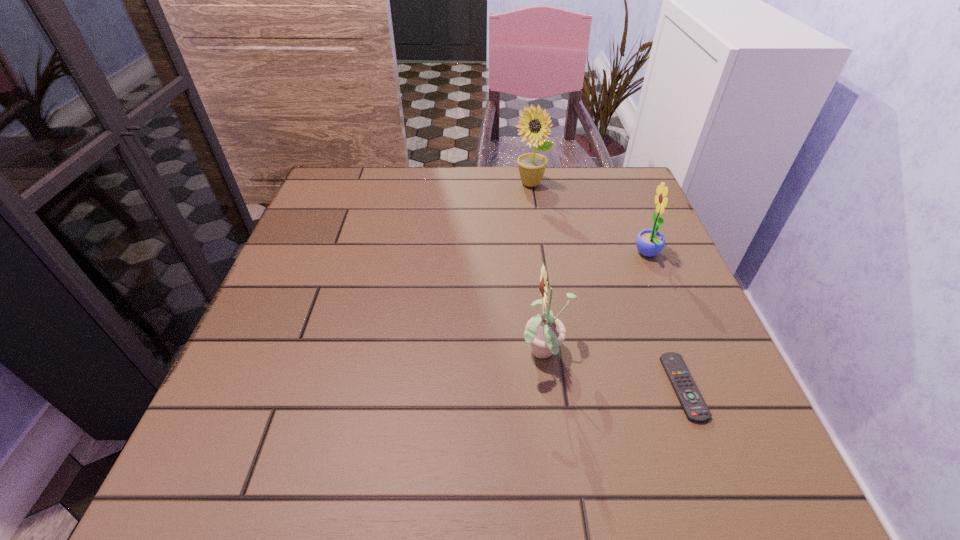
I want to click on vacant space situated on the front-facing side of the rightmost sunflower, so click(553, 254).

Identify the location of free space located 0.320m on the front-facing side of the rightmost sunflower. (490, 254).

Where is `blank space located 0.390m on the left of the shortest object`? This screenshot has width=960, height=540. blank space located 0.390m on the left of the shortest object is located at coordinates pyautogui.click(x=435, y=387).

You are a GUI agent. You are given a task and a screenshot of the screen. Output one action in this format:
    pyautogui.click(x=<x>, y=<y>)
    Task: Click on the object that is at the far edge
    This screenshot has height=540, width=960.
    Given the screenshot: What is the action you would take?
    pyautogui.click(x=532, y=166)

The image size is (960, 540). What are the coordinates of `sunflower that is at the right edge` in the screenshot? It's located at (649, 242).

You are a GUI agent. You are given a task and a screenshot of the screen. Output one action in this format:
    pyautogui.click(x=<x>, y=<y>)
    Task: Click on the remote control positioned at the right edge
    
    Given the screenshot: What is the action you would take?
    pyautogui.click(x=696, y=410)

Where is `vacant region at the far edge of the desktop`? This screenshot has height=540, width=960. vacant region at the far edge of the desktop is located at coordinates (421, 179).

The height and width of the screenshot is (540, 960). In the image, there is a desktop. Find the location of `free space at the near edge`. free space at the near edge is located at coordinates (574, 449).

Locate an element on the screen. vacant space at the left edge of the desktop is located at coordinates (325, 300).

I want to click on vacant space at the right edge of the desktop, so click(710, 392).